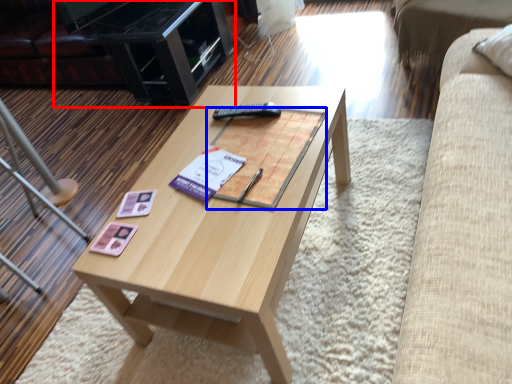
Question: Which object appears farthest to the camera in this image, entertainment center (highlighted by a red box) or magazine (highlighted by a blue box)?

Choices:
 (A) entertainment center
 (B) magazine

Answer: (A)